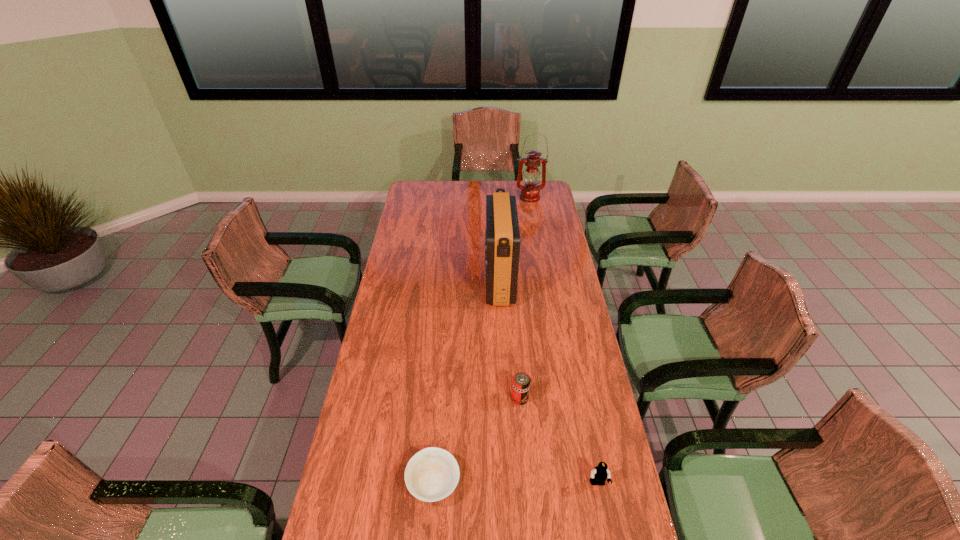
Where is `free space between the third farthest object and the fourth nearest object`? Image resolution: width=960 pixels, height=540 pixels. free space between the third farthest object and the fourth nearest object is located at coordinates (510, 340).

The height and width of the screenshot is (540, 960). Find the location of `free spot between the third nearest object and the radio receiver`. free spot between the third nearest object and the radio receiver is located at coordinates [x=510, y=340].

Identify the location of free space that is in between the Lego and the fourth nearest object. (548, 383).

This screenshot has height=540, width=960. What are the coordinates of `free space between the oil lamp and the can` in the screenshot? It's located at (525, 298).

Locate an element on the screen. free spot between the Lego and the fourth nearest object is located at coordinates (548, 383).

Identify the location of object that is the third closest one to the Lego. (502, 235).

Locate which object ranks in proximity to the can. Please provide its 2D coordinates. Your answer should be formatted as a tuple, i.e. [(x, y)], where the tuple contains the x and y coordinates of a point satisfying the conditions above.

[(432, 474)]

Identify the location of vacant space that satisfies the following two spatial constraints: 1. on the front side of the farthest object; 2. on the front-facing side of the second farthest object. This screenshot has height=540, width=960. (543, 282).

You are a GUI agent. You are given a task and a screenshot of the screen. Output one action in this format:
    pyautogui.click(x=<x>, y=<y>)
    Task: Click on the free space that satisfies the following two spatial constraints: 1. on the front-facing side of the can; 2. on the right side of the second farthest object
    This screenshot has height=540, width=960.
    Given the screenshot: What is the action you would take?
    pyautogui.click(x=505, y=398)